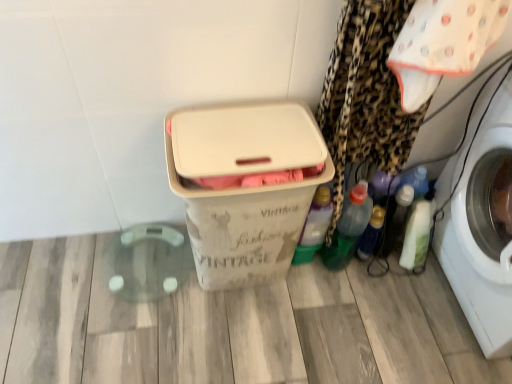
Locate an element on the screen. green translucent bottle at center-right, the first bottle positioned from the left is located at coordinates (314, 226).

Measure the distance between point (x=220, y=208) and camera.

Point (x=220, y=208) and camera are 3.66 feet apart.

How much space does green plastic bottle at lower right, marked as the second bottle in a left-to-right arrangement, occupy vertically?

green plastic bottle at lower right, marked as the second bottle in a left-to-right arrangement, is 14.78 inches tall.

What do you see at coordinates (348, 228) in the screenshot? I see `green plastic bottle at lower right, marked as the second bottle in a left-to-right arrangement` at bounding box center [348, 228].

Locate an element on the screen. This screenshot has width=512, height=384. translucent plastic bottle at lower right, the second bottle in the right-to-left sequence is located at coordinates (371, 233).

Is white glossy bottle at lower right, placed as the first bottle when sorted from right to left, shorter than beige plastic storage box at center?

Yes, white glossy bottle at lower right, placed as the first bottle when sorted from right to left, is shorter than beige plastic storage box at center.

Considering the sizes of objects white glossy bottle at lower right, placed as the first bottle when sorted from right to left, and beige plastic storage box at center in the image provided, who is smaller, white glossy bottle at lower right, placed as the first bottle when sorted from right to left, or beige plastic storage box at center?

With smaller size is white glossy bottle at lower right, placed as the first bottle when sorted from right to left.

Image resolution: width=512 pixels, height=384 pixels. I want to click on storage box above the white glossy bottle at lower right, placed as the first bottle when sorted from right to left (from a real-world perspective), so click(x=244, y=186).

Considering the sizes of objects leopard print fabric at right and beige plastic storage box at center in the image provided, who is taller, leopard print fabric at right or beige plastic storage box at center?

Standing taller between the two is leopard print fabric at right.

In the scene shown: Considering the positions of objects leopard print fabric at right and beige plastic storage box at center in the image provided, who is behind, leopard print fabric at right or beige plastic storage box at center?

beige plastic storage box at center is more distant.

Is leopard print fabric at right directly adjacent to beige plastic storage box at center?

No, leopard print fabric at right is not beside beige plastic storage box at center.

Considering the sizes of white plastic washing machine at right and green plastic bottle at lower right, marked as the second bottle in a left-to-right arrangement, in the image, is white plastic washing machine at right wider or thinner than green plastic bottle at lower right, marked as the second bottle in a left-to-right arrangement,?

In the image, white plastic washing machine at right appears to be wider than green plastic bottle at lower right, marked as the second bottle in a left-to-right arrangement.

Which is behind, white plastic washing machine at right or green plastic bottle at lower right, marked as the second bottle in a left-to-right arrangement?

green plastic bottle at lower right, marked as the second bottle in a left-to-right arrangement, is further from the camera.

Does white plastic washing machine at right appear on the left side of green plastic bottle at lower right, marked as the second bottle in a left-to-right arrangement?

In fact, white plastic washing machine at right is to the right of green plastic bottle at lower right, marked as the second bottle in a left-to-right arrangement.

Does beige plastic storage box at center have a smaller size compared to translucent plastic bottle at lower right, the 3th bottle positioned from the left?

Incorrect, beige plastic storage box at center is not smaller in size than translucent plastic bottle at lower right, the 3th bottle positioned from the left.

How distant is beige plastic storage box at center from translucent plastic bottle at lower right, the 3th bottle positioned from the left?

The distance of beige plastic storage box at center from translucent plastic bottle at lower right, the 3th bottle positioned from the left, is 22.14 inches.

Considering the positions of objects beige plastic storage box at center and translucent plastic bottle at lower right, the second bottle in the right-to-left sequence, in the image provided, who is more to the right, beige plastic storage box at center or translucent plastic bottle at lower right, the second bottle in the right-to-left sequence,?

translucent plastic bottle at lower right, the second bottle in the right-to-left sequence.

Considering the sizes of green plastic bottle at lower right, the 3th bottle viewed from the right, and white cotton cloth at upper right in the image, is green plastic bottle at lower right, the 3th bottle viewed from the right, wider or thinner than white cotton cloth at upper right?

green plastic bottle at lower right, the 3th bottle viewed from the right, is thinner than white cotton cloth at upper right.

Is green plastic bottle at lower right, marked as the second bottle in a left-to-right arrangement, far away from white cotton cloth at upper right?

No, green plastic bottle at lower right, marked as the second bottle in a left-to-right arrangement, is in close proximity to white cotton cloth at upper right.

From a real-world perspective, count 2nd bottles downward from the white cotton cloth at upper right and point to it. Please provide its 2D coordinates.

[(348, 228)]

From a real-world perspective, which is physically above, white cotton cloth at upper right or leopard print fabric at right?

From a 3D spatial view, white cotton cloth at upper right is above.

From the image's perspective, which one is positioned lower, white cotton cloth at upper right or leopard print fabric at right?

leopard print fabric at right appears lower in the image.

I want to click on baby clothe on the right side of leopard print fabric at right, so point(443,44).

Looking at the image, does white cotton cloth at upper right seem bigger or smaller compared to white plastic washing machine at right?

white cotton cloth at upper right is smaller than white plastic washing machine at right.

Could you tell me if white cotton cloth at upper right is turned towards white plastic washing machine at right?

No, white cotton cloth at upper right does not turn towards white plastic washing machine at right.

From the image's perspective, which object appears higher, white cotton cloth at upper right or white plastic washing machine at right?

white cotton cloth at upper right is shown above in the image.

Based on the photo, from a real-world perspective, is white cotton cloth at upper right above or below white plastic washing machine at right?

In terms of real-world spatial position, white cotton cloth at upper right is above white plastic washing machine at right.

Identify the location of storage box above the white glossy bottle at lower right, marked as the fourth bottle in a left-to-right arrangement (from the image's perspective). Image resolution: width=512 pixels, height=384 pixels. (244, 186).

I want to click on curtain above the beige plastic storage box at center (from a real-world perspective), so [365, 95].

Considering their positions, is white glossy bottle at lower right, placed as the first bottle when sorted from right to left, positioned closer to beige plastic storage box at center than green translucent bottle at center-right, which is counted as the fourth bottle, starting from the right?

The object closer to beige plastic storage box at center is green translucent bottle at center-right, which is counted as the fourth bottle, starting from the right.

Looking at the image, which one is located further to leopard print fabric at right, white plastic washing machine at right or white cotton cloth at upper right?

white plastic washing machine at right is further to leopard print fabric at right.

Considering their positions, is beige plastic storage box at center positioned further to green plastic bottle at lower right, the 3th bottle viewed from the right, than translucent plastic bottle at lower right, the 3th bottle positioned from the left?

The object further to green plastic bottle at lower right, the 3th bottle viewed from the right, is beige plastic storage box at center.

When comparing their distances from white glossy bottle at lower right, placed as the first bottle when sorted from right to left, does translucent plastic bottle at lower right, the second bottle in the right-to-left sequence, or beige plastic storage box at center seem closer?

Based on the image, translucent plastic bottle at lower right, the second bottle in the right-to-left sequence, appears to be nearer to white glossy bottle at lower right, placed as the first bottle when sorted from right to left.

When comparing their distances from white plastic washing machine at right, does white glossy bottle at lower right, marked as the fourth bottle in a left-to-right arrangement, or leopard print fabric at right seem closer?

The object closer to white plastic washing machine at right is white glossy bottle at lower right, marked as the fourth bottle in a left-to-right arrangement.

Considering their positions, is green translucent bottle at center-right, the first bottle positioned from the left, positioned further to white cotton cloth at upper right than beige plastic storage box at center?

Among the two, green translucent bottle at center-right, the first bottle positioned from the left, is located further to white cotton cloth at upper right.

Looking at this image, estimate the real-world distances between objects in this image. Which object is further from green plastic bottle at lower right, marked as the second bottle in a left-to-right arrangement, translucent plastic bottle at lower right, the 3th bottle positioned from the left, or white cotton cloth at upper right?

Among the two, white cotton cloth at upper right is located further to green plastic bottle at lower right, marked as the second bottle in a left-to-right arrangement.

Looking at the image, which one is located further to green translucent bottle at center-right, which is counted as the fourth bottle, starting from the right, white plastic washing machine at right or green plastic bottle at lower right, marked as the second bottle in a left-to-right arrangement?

white plastic washing machine at right.

Identify the location of storage box between white cotton cloth at upper right and translucent plastic bottle at lower right, the second bottle in the right-to-left sequence, along the z-axis. (244, 186).

Where is `baby clothe between leopard print fabric at right and green translucent bottle at center-right, which is counted as the fourth bottle, starting from the right, in the front-back direction`? baby clothe between leopard print fabric at right and green translucent bottle at center-right, which is counted as the fourth bottle, starting from the right, in the front-back direction is located at coordinates (443, 44).

Find the location of a particular element. curtain between green translucent bottle at center-right, the first bottle positioned from the left, and white plastic washing machine at right from left to right is located at coordinates (365, 95).

Image resolution: width=512 pixels, height=384 pixels. Find the location of `storage box between leopard print fabric at right and green plastic bottle at lower right, the 3th bottle viewed from the right, along the z-axis`. storage box between leopard print fabric at right and green plastic bottle at lower right, the 3th bottle viewed from the right, along the z-axis is located at coordinates (244, 186).